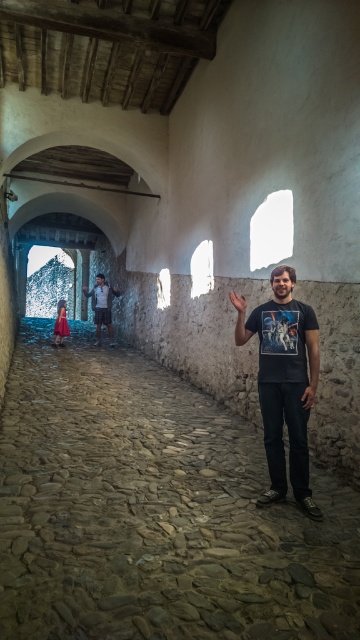
You are standing in the medieval corridor and see the smooth stone floor at center and the matte red dress at far left. Which object is positioned to the right of the other?

The smooth stone floor at center is to the right of the matte red dress at far left.